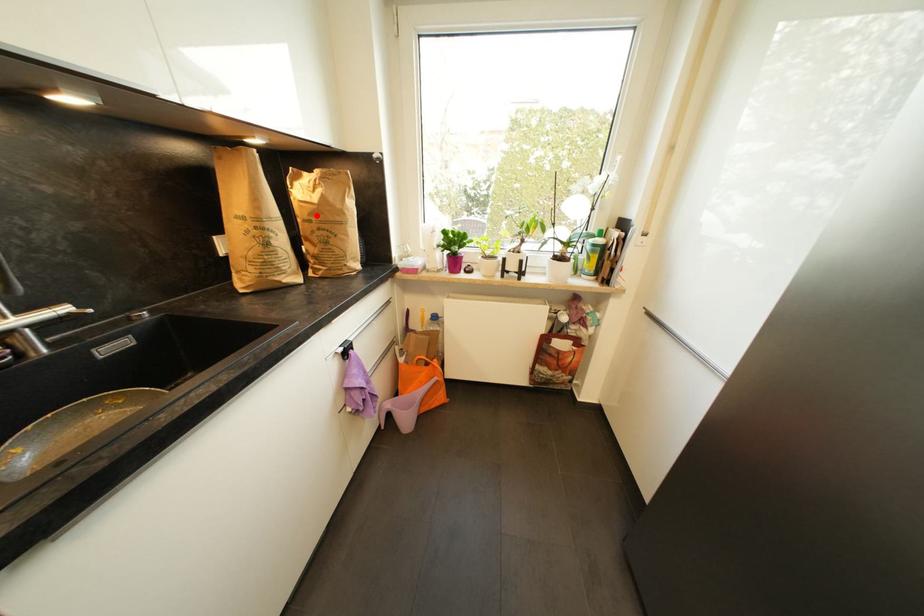
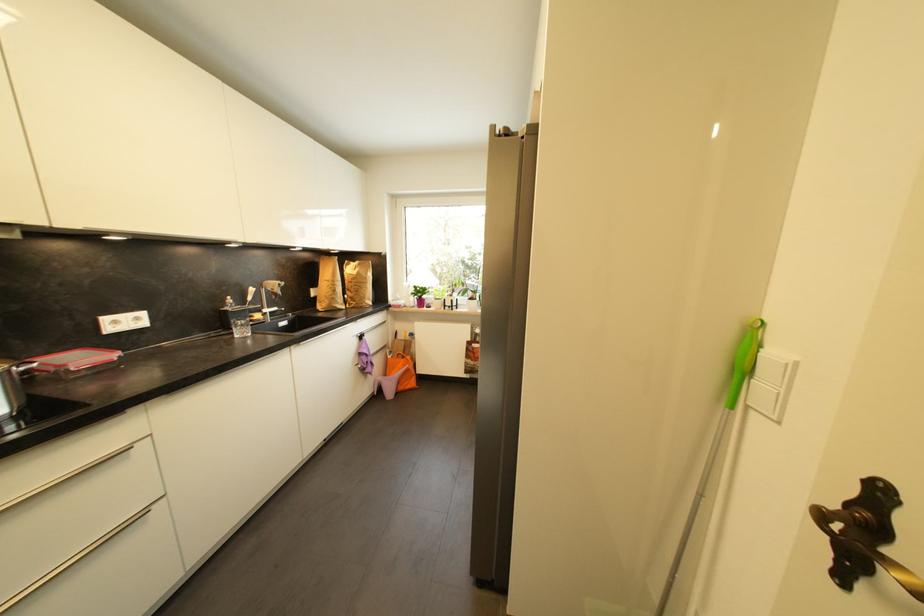
Where in the second image is the point corresponding to the highlighted location from the first image?

(358, 281)